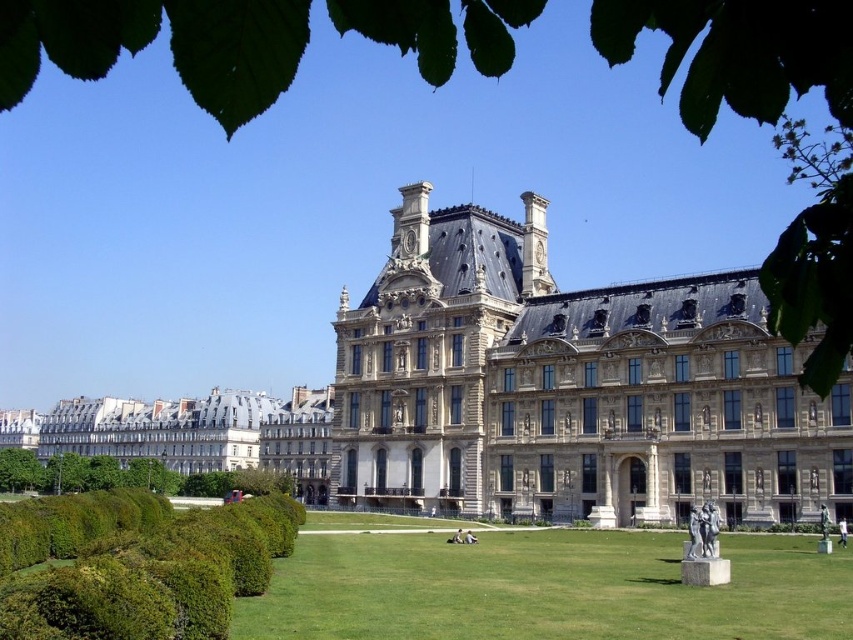
Is beige stone palace at center positioned before white marble statue at lower right?

No.

Does point (538, 234) come closer to viewer compared to point (695, 508)?

No, it is behind (695, 508).

The image size is (853, 640). Describe the element at coordinates (570, 387) in the screenshot. I see `beige stone palace at center` at that location.

Locate an element on the screen. The image size is (853, 640). beige stone palace at center is located at coordinates (570, 387).

Between green grass at center and white marble statue at lower right, which one appears on the left side from the viewer's perspective?

From the viewer's perspective, green grass at center appears more on the left side.

Is point (590, 536) positioned before point (699, 556)?

No, (590, 536) is further to viewer.

The height and width of the screenshot is (640, 853). Describe the element at coordinates (543, 588) in the screenshot. I see `green grass at center` at that location.

Identify the location of green grass at center. [543, 588].

Is green leafy hedge at lower left to the left of white marble statue at lower right from the viewer's perspective?

Yes, green leafy hedge at lower left is to the left of white marble statue at lower right.

Which is in front, point (93, 566) or point (689, 548)?

Point (93, 566)

This screenshot has width=853, height=640. I want to click on green leafy hedge at lower left, so click(x=155, y=577).